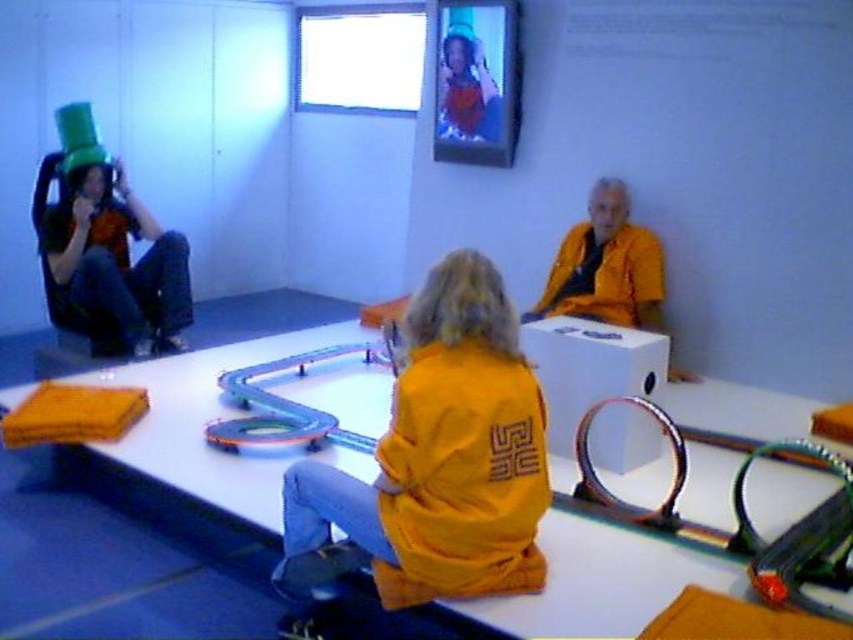
Question: Which point is closer to the camera?

Choices:
 (A) matte black robe at left
 (B) yellow matte jacket at center
 (C) orange matte jacket at right

Answer: (B)

Question: Can you confirm if white glossy table at center is positioned below matte black robe at left?

Choices:
 (A) no
 (B) yes

Answer: (B)

Question: Where is matte green hat at upper left located in relation to matte black robe at left in the image?

Choices:
 (A) left
 (B) right

Answer: (B)

Question: Which of the following is the farthest from the observer?

Choices:
 (A) matte black robe at left
 (B) yellow matte jacket at center
 (C) matte green hat at upper left

Answer: (C)

Question: Which point is farther from the camera taking this photo?

Choices:
 (A) (91, 205)
 (B) (166, 481)
 (C) (579, 225)
 (D) (531, 499)

Answer: (C)

Question: Is the position of white glossy table at center less distant than that of matte green hat at upper left?

Choices:
 (A) yes
 (B) no

Answer: (A)